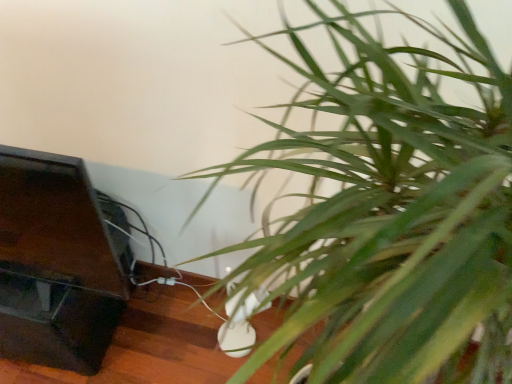
What do you see at coordinates (389, 212) in the screenshot? I see `green leafy plant at lower right` at bounding box center [389, 212].

The height and width of the screenshot is (384, 512). I want to click on green leafy plant at lower right, so click(389, 212).

Consider the image. In order to face green leafy plant at lower right, should I rotate leftwards or rightwards?

To face it directly, rotate right by 20.540 degrees.

Where is `dark wood table at lower left`? The image size is (512, 384). dark wood table at lower left is located at coordinates (58, 263).

What do you see at coordinates (58, 263) in the screenshot? I see `dark wood table at lower left` at bounding box center [58, 263].

Image resolution: width=512 pixels, height=384 pixels. I want to click on green leafy plant at lower right, so click(x=389, y=212).

Can you confirm if dark wood table at lower left is positioned to the left of green leafy plant at lower right?

Correct, you'll find dark wood table at lower left to the left of green leafy plant at lower right.

Is dark wood table at lower left behind green leafy plant at lower right?

That is True.

Considering the positions of points (82, 178) and (430, 220), is point (82, 178) farther from camera compared to point (430, 220)?

Yes, it is behind point (430, 220).

From the image's perspective, which is below, dark wood table at lower left or green leafy plant at lower right?

dark wood table at lower left appears lower in the image.

From a real-world perspective, is dark wood table at lower left positioned under green leafy plant at lower right based on gravity?

Yes.

Consider the image. Can you confirm if dark wood table at lower left is wider than green leafy plant at lower right?

In fact, dark wood table at lower left might be narrower than green leafy plant at lower right.

Considering the sizes of dark wood table at lower left and green leafy plant at lower right in the image, is dark wood table at lower left taller or shorter than green leafy plant at lower right?

Clearly, dark wood table at lower left is shorter compared to green leafy plant at lower right.

Who is smaller, dark wood table at lower left or green leafy plant at lower right?

dark wood table at lower left.

Is dark wood table at lower left positioned beyond the bounds of green leafy plant at lower right?

Yes, dark wood table at lower left is located beyond the bounds of green leafy plant at lower right.

Are dark wood table at lower left and green leafy plant at lower right making contact?

There is a gap between dark wood table at lower left and green leafy plant at lower right.

Is dark wood table at lower left oriented towards green leafy plant at lower right?

No, dark wood table at lower left does not turn towards green leafy plant at lower right.

Identify the location of houseplant that appears above the dark wood table at lower left (from a real-world perspective). (389, 212).

Is green leafy plant at lower right to the left or to the right of dark wood table at lower left in the image?

Based on their positions, green leafy plant at lower right is located to the right of dark wood table at lower left.

Which object is further away from the camera, green leafy plant at lower right or dark wood table at lower left?

dark wood table at lower left is behind.

Between point (503, 243) and point (54, 158), which one is positioned in front?

The point (503, 243) is in front.

From the image's perspective, would you say green leafy plant at lower right is shown under dark wood table at lower left?

Incorrect, from the image's perspective, green leafy plant at lower right is higher than dark wood table at lower left.

From a real-world perspective, which is physically above, green leafy plant at lower right or dark wood table at lower left?

From a 3D spatial view, green leafy plant at lower right is above.

Which object is thinner, green leafy plant at lower right or dark wood table at lower left?

dark wood table at lower left is thinner.

From their relative heights in the image, would you say green leafy plant at lower right is taller or shorter than dark wood table at lower left?

Considering their sizes, green leafy plant at lower right has more height than dark wood table at lower left.

Considering the relative sizes of green leafy plant at lower right and dark wood table at lower left in the image provided, is green leafy plant at lower right smaller than dark wood table at lower left?

Actually, green leafy plant at lower right might be larger than dark wood table at lower left.

Is dark wood table at lower left inside green leafy plant at lower right?

No, dark wood table at lower left is located outside of green leafy plant at lower right.

Is green leafy plant at lower right not close to dark wood table at lower left?

green leafy plant at lower right is actually quite close to dark wood table at lower left.

Is green leafy plant at lower right facing away from dark wood table at lower left?

No, green leafy plant at lower right's orientation is not away from dark wood table at lower left.

How distant is green leafy plant at lower right from dark wood table at lower left?

22.60 inches.

What are the coordinates of `houseplant that appears in front of the dark wood table at lower left` in the screenshot? It's located at (389, 212).

This screenshot has width=512, height=384. What are the coordinates of `houseplant on the right of dark wood table at lower left` in the screenshot? It's located at (389, 212).

Where is `furniture below the green leafy plant at lower right (from the image's perspective)`? The height and width of the screenshot is (384, 512). furniture below the green leafy plant at lower right (from the image's perspective) is located at coordinates (58, 263).